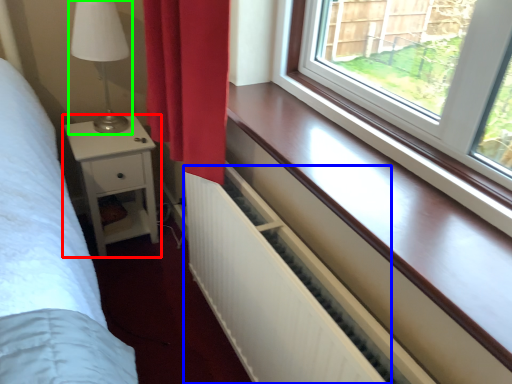
Question: Based on their relative distances, which object is farther from nightstand (highlighted by a red box)? Choose from radiator (highlighted by a blue box) and table lamp (highlighted by a green box).

Choices:
 (A) radiator
 (B) table lamp

Answer: (A)